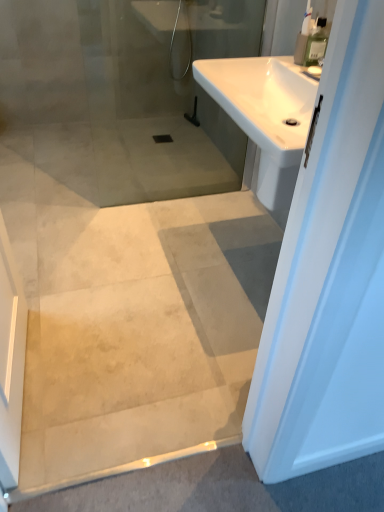
Question: From a real-world perspective, relative to white glossy sink at upper right, is clear plastic bottle at upper right vertically above or below?

Choices:
 (A) above
 (B) below

Answer: (A)

Question: From their relative heights in the image, would you say clear plastic bottle at upper right is taller or shorter than white glossy sink at upper right?

Choices:
 (A) tall
 (B) short

Answer: (A)

Question: Is clear plastic bottle at upper right inside the boundaries of white glossy sink at upper right, or outside?

Choices:
 (A) outside
 (B) inside

Answer: (A)

Question: Considering the positions of white glossy sink at upper right and clear plastic bottle at upper right in the image, is white glossy sink at upper right wider or thinner than clear plastic bottle at upper right?

Choices:
 (A) wide
 (B) thin

Answer: (A)

Question: From their relative heights in the image, would you say white glossy sink at upper right is taller or shorter than clear plastic bottle at upper right?

Choices:
 (A) short
 (B) tall

Answer: (A)

Question: Visually, is white glossy sink at upper right positioned to the left or to the right of clear plastic bottle at upper right?

Choices:
 (A) right
 (B) left

Answer: (B)

Question: From a real-world perspective, relative to clear plastic bottle at upper right, is white glossy sink at upper right vertically above or below?

Choices:
 (A) below
 (B) above

Answer: (A)